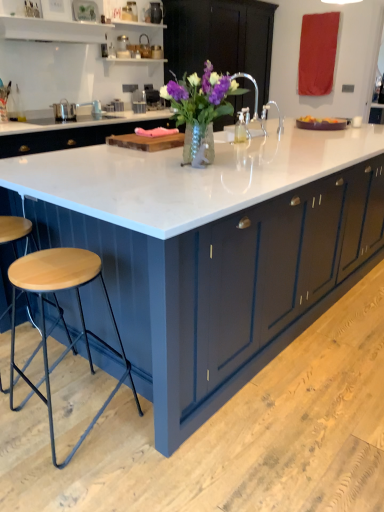
Question: From the image's perspective, is translucent glass vase with purple flowers at center positioned above or below white marble countertop at center?

Choices:
 (A) below
 (B) above

Answer: (B)

Question: Based on their positions, is translucent glass vase with purple flowers at center located to the left or right of white marble countertop at center?

Choices:
 (A) right
 (B) left

Answer: (B)

Question: Which object is positioned closest to the white marble countertop at center?

Choices:
 (A) wooden cutting board at center
 (B) matte dark blue cabinet at center
 (C) wooden seat stool at lower left
 (D) translucent glass vase with purple flowers at center

Answer: (C)

Question: Which of these objects is positioned farthest from the wooden cutting board at center?

Choices:
 (A) translucent glass vase with purple flowers at center
 (B) matte dark blue cabinet at center
 (C) wooden seat stool at lower left
 (D) white marble countertop at center

Answer: (B)